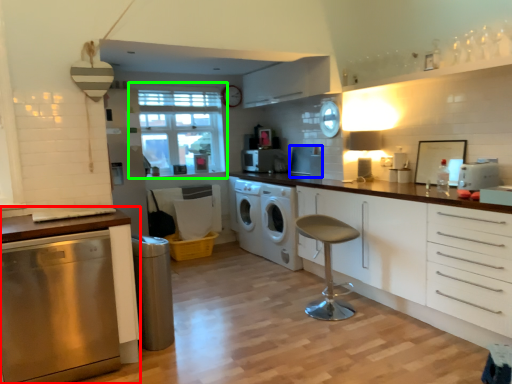
Question: Based on their relative distances, which object is farther from cabinetry (highlighted by a red box)? Choose from appliance (highlighted by a blue box) and window (highlighted by a green box).

Choices:
 (A) appliance
 (B) window

Answer: (B)